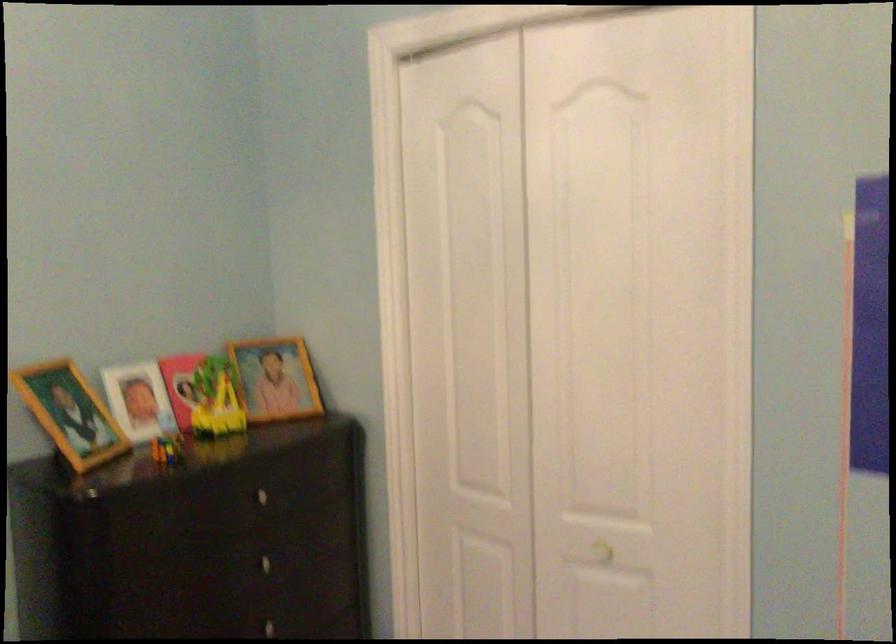
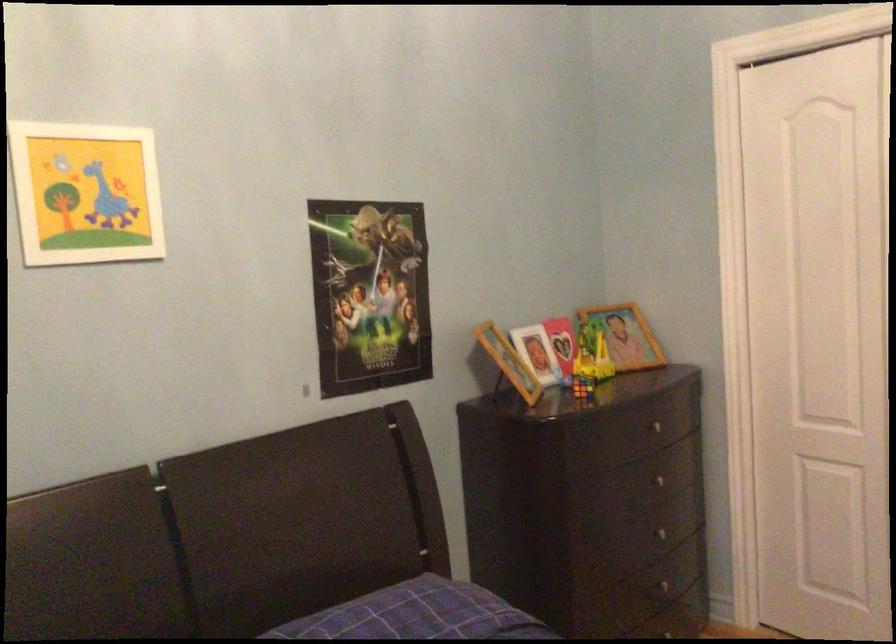
Question: Based on the continuous images, in which direction is the camera rotating? Reply with the corresponding letter.

Choices:
 (A) Left
 (B) Right
 (C) Up
 (D) Down

Answer: (A)